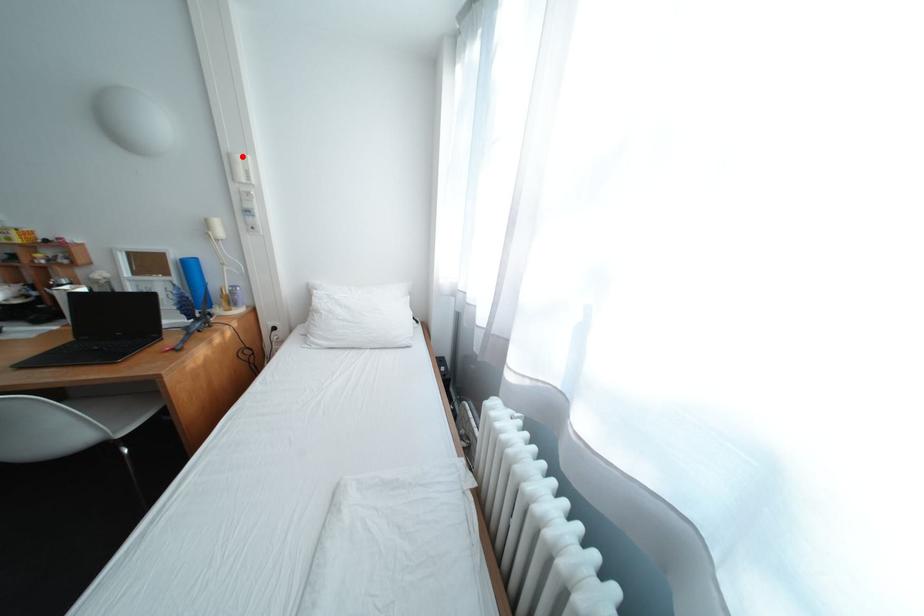
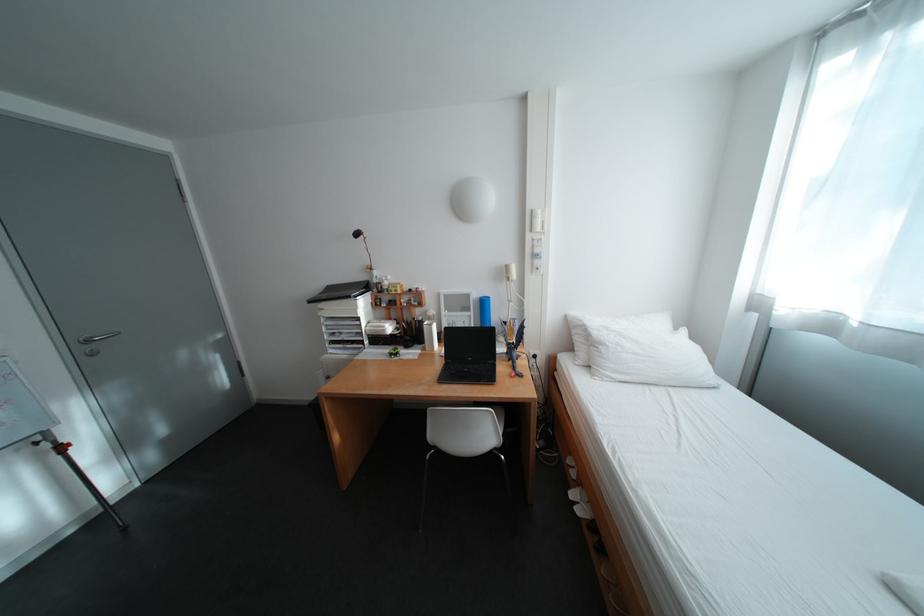
The point at the highlighted location is marked in the first image. Where is the corresponding point in the second image?

(544, 213)